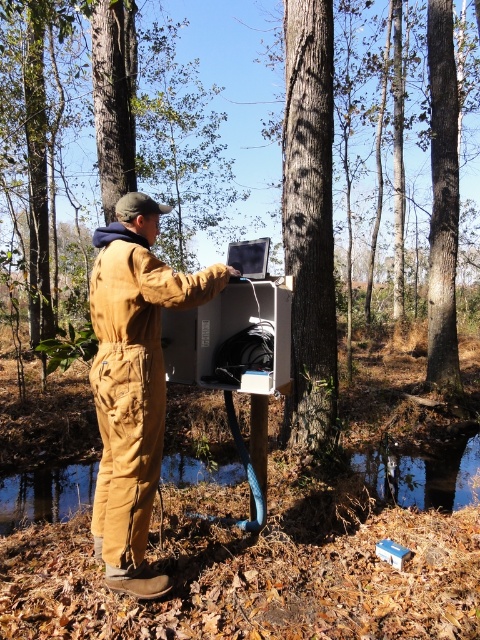
You are a park ranger who needs to locate the brown cotton jumpsuit at center and the smooth bark tree at center in the image. According to the scene, which object is more to the left?

The brown cotton jumpsuit at center is more to the left than the smooth bark tree at center because it is positioned on the left side of it.

You are standing in the wooded area and want to determine which of the two points, point (111, 451) or point (285, 33), is nearer to you. Based on the scene, which point is closer?

Point (111, 451) is closer to the viewer than point (285, 33).